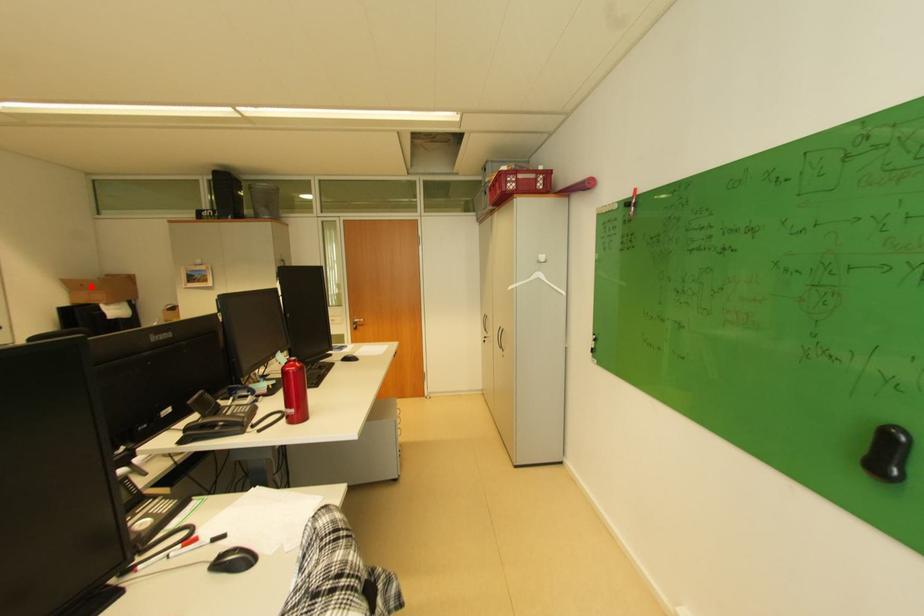
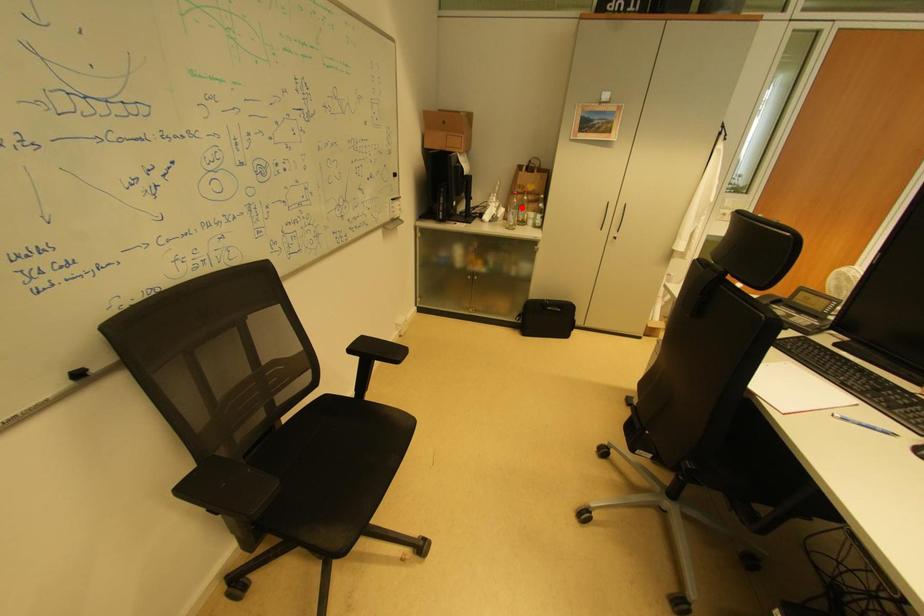
I am providing you with two images of the same scene from different viewpoints. A red point is marked on the first image and another point is marked on the second image. Do the highlighted points in image1 and image2 indicate the same real-world spot?

No